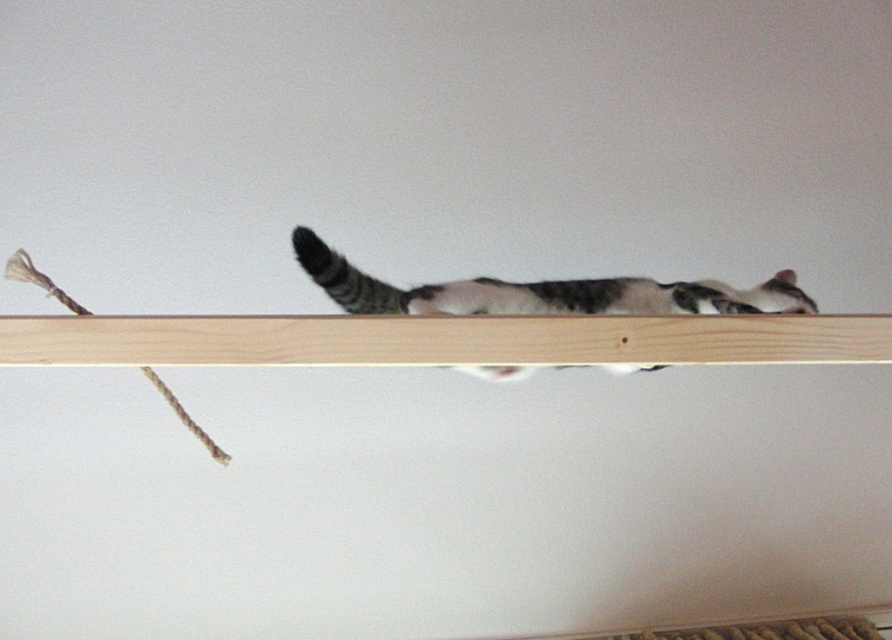
Question: Which of the following is the closest to the observer?

Choices:
 (A) light wood shelf at center
 (B) gray tabby cat at center

Answer: (A)

Question: Is light wood shelf at center below gray tabby cat at center?

Choices:
 (A) no
 (B) yes

Answer: (B)

Question: Which point appears farthest from the camera in this image?

Choices:
 (A) (463, 344)
 (B) (326, 269)

Answer: (B)

Question: Is light wood shelf at center closer to the viewer compared to gray tabby cat at center?

Choices:
 (A) yes
 (B) no

Answer: (A)

Question: Is light wood shelf at center smaller than gray tabby cat at center?

Choices:
 (A) yes
 (B) no

Answer: (A)